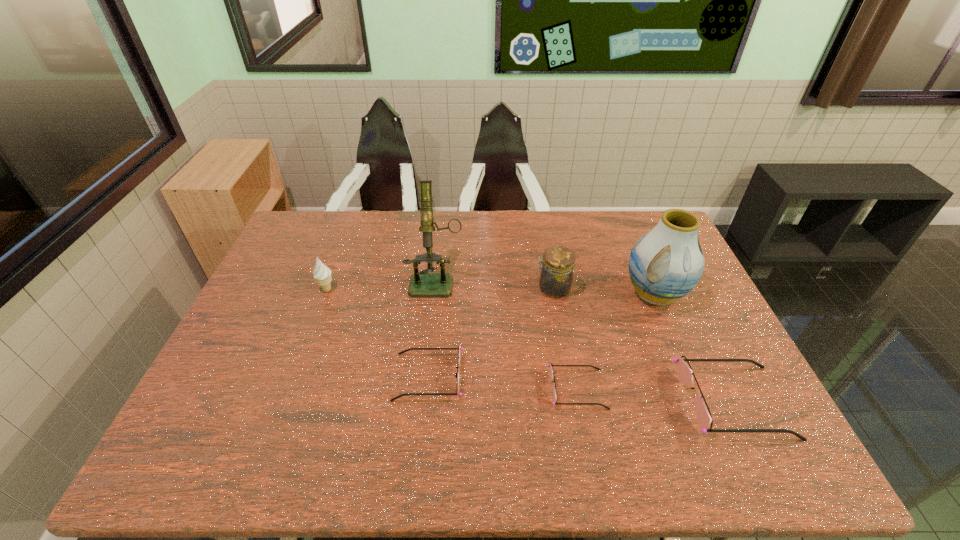
You are a GUI agent. You are given a task and a screenshot of the screen. Output one action in this format:
    pyautogui.click(x=<x>, y=<y>)
    Task: Click on the sunglasses situated at the right edge
    
    Given the screenshot: What is the action you would take?
    pyautogui.click(x=685, y=374)

The image size is (960, 540). I want to click on vase situated at the right edge, so click(x=666, y=263).

You are a GUI agent. You are given a task and a screenshot of the screen. Output one action in this format:
    pyautogui.click(x=<x>, y=<y>)
    Task: Click on the object located at the near right corner
    The height and width of the screenshot is (540, 960).
    Given the screenshot: What is the action you would take?
    pyautogui.click(x=685, y=374)

In the image, there is a desktop. Find the location of `vacant area at the far edge`. vacant area at the far edge is located at coordinates (501, 214).

This screenshot has height=540, width=960. Find the location of `vacant space at the near edge of the desktop`. vacant space at the near edge of the desktop is located at coordinates (360, 415).

The width and height of the screenshot is (960, 540). What are the coordinates of `vacant space at the left edge of the desktop` in the screenshot? It's located at (275, 269).

Where is `free space at the far left corner of the desktop`? The height and width of the screenshot is (540, 960). free space at the far left corner of the desktop is located at coordinates (307, 223).

At what (x,y) coordinates should I click in order to perform the action: click on blank space at the near left corner of the desktop. Please return your answer as a coordinate pair (x, y). This screenshot has height=540, width=960. Looking at the image, I should click on (186, 422).

Find the location of a particular element. This screenshot has width=960, height=540. vacant point located between the microscope and the leftmost object is located at coordinates (382, 285).

At what (x,y) coordinates should I click in order to perform the action: click on free space between the second sunglasses from left to right and the tallest sunglasses. Please return your answer as a coordinate pair (x, y). Looking at the image, I should click on (655, 395).